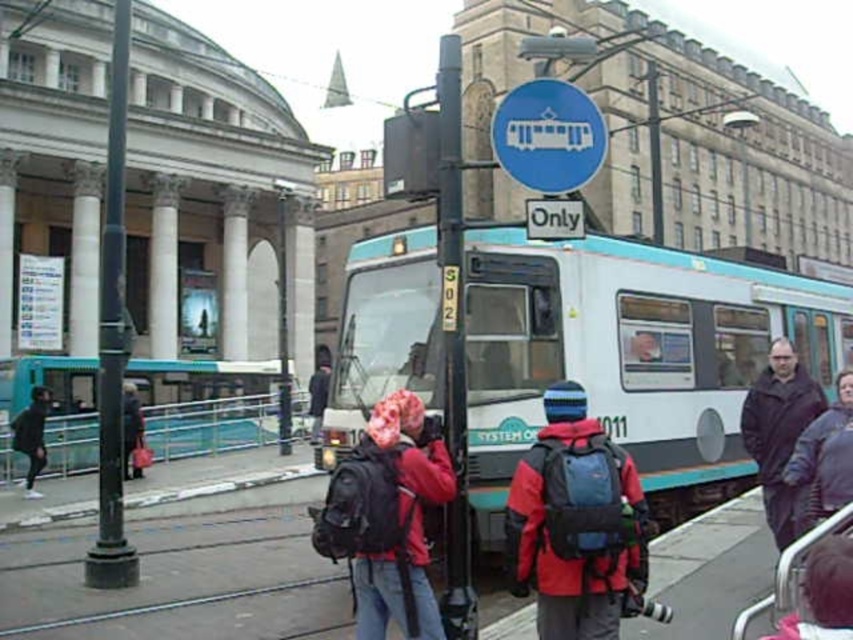
Between matte red jacket at center and dark brown leather jacket at right, which one is positioned higher?

Positioned higher is dark brown leather jacket at right.

Is point (624, 452) farther from camera compared to point (787, 426)?

No.

Find the location of a particular element. This screenshot has height=640, width=853. matte red jacket at center is located at coordinates (572, 520).

Between teal/white passenger train at center and dark brown leather jacket at right, which one is positioned lower?

dark brown leather jacket at right

Is point (628, 349) positioned after point (763, 480)?

Yes, it is.

I want to click on teal/white passenger train at center, so click(x=630, y=356).

You are a GUI agent. You are given a task and a screenshot of the screen. Output one action in this format:
    pyautogui.click(x=<x>, y=<y>)
    Task: Click on the teal/white passenger train at center
    This screenshot has height=640, width=853.
    Given the screenshot: What is the action you would take?
    pyautogui.click(x=630, y=356)

Identify the location of teal/white passenger train at center. (630, 356).

Who is positioned more to the right, teal/white passenger train at center or matte red jacket at center?

Positioned to the right is teal/white passenger train at center.

Between point (474, 296) and point (601, 525), which one is positioned in front?

Point (601, 525)

Where is `teal/white passenger train at center`? This screenshot has width=853, height=640. teal/white passenger train at center is located at coordinates (630, 356).